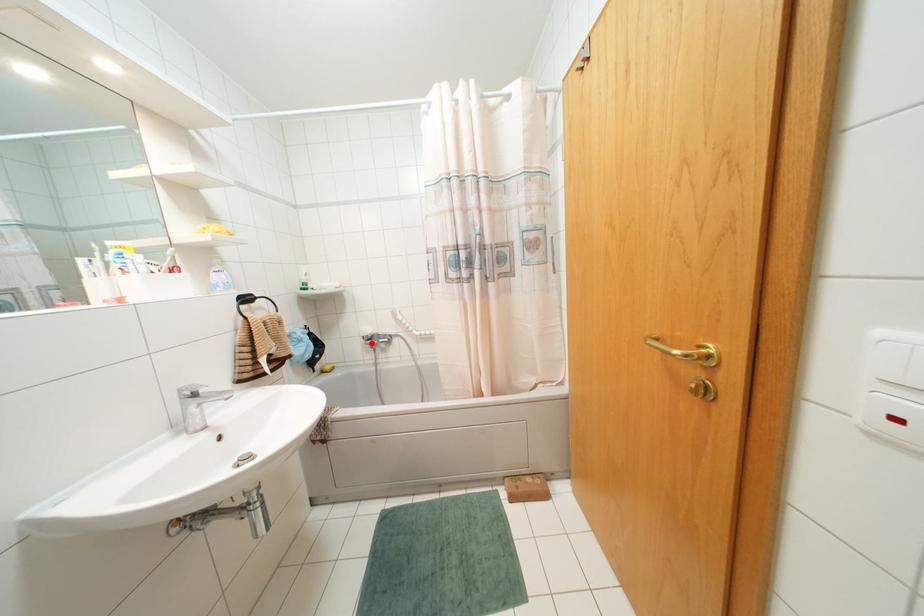
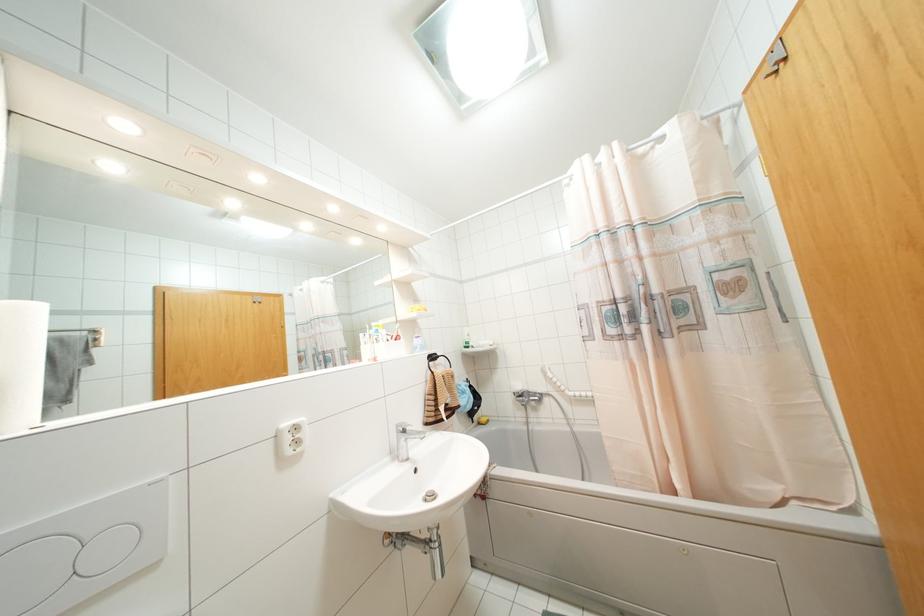
Question: I am providing you with two images of the same scene from different viewpoints. A red point is marked on the first image. Can you still see the location of the red point in image 2?

Choices:
 (A) Yes
 (B) No

Answer: (A)